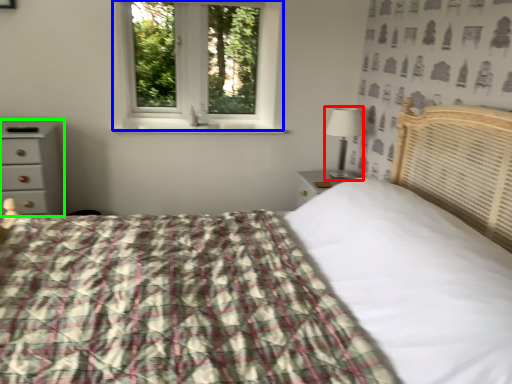
Question: Which is nearer to the table lamp (highlighted by a red box)? window (highlighted by a blue box) or chest of drawers (highlighted by a green box).

Choices:
 (A) window
 (B) chest of drawers

Answer: (A)